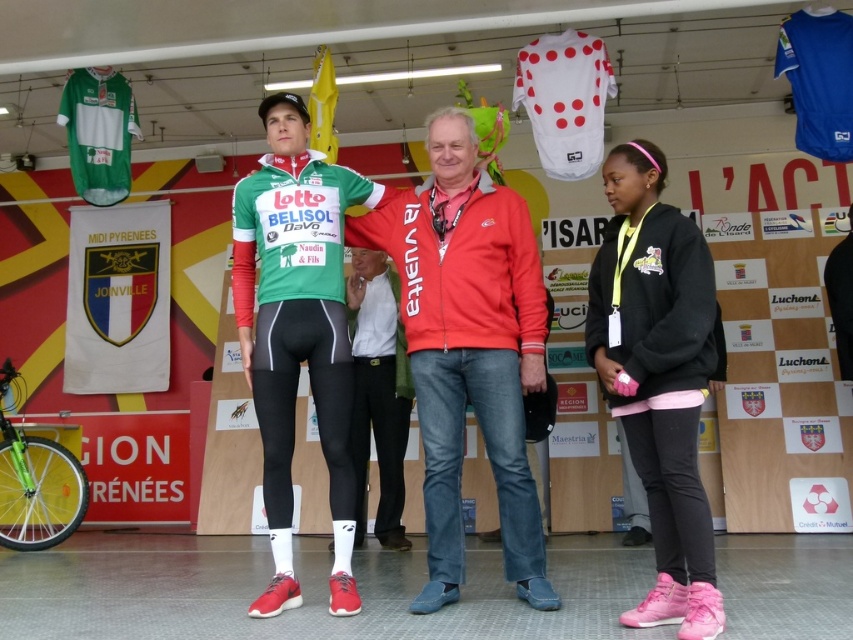
Question: Which point is farther from the camera taking this photo?

Choices:
 (A) (479, 296)
 (B) (692, 460)

Answer: (A)

Question: Is red fabric jacket at center further to the viewer compared to black fleece jacket at lower right?

Choices:
 (A) no
 (B) yes

Answer: (B)

Question: Which point is closer to the camera?

Choices:
 (A) red fabric jacket at center
 (B) black fleece jacket at lower right

Answer: (B)

Question: Where is red fabric jacket at center located in relation to black fleece jacket at lower right in the image?

Choices:
 (A) above
 (B) below

Answer: (A)

Question: Can you confirm if red fabric jacket at center is positioned to the left of black fleece jacket at lower right?

Choices:
 (A) yes
 (B) no

Answer: (A)